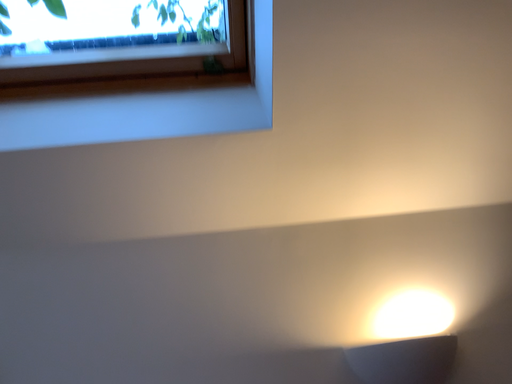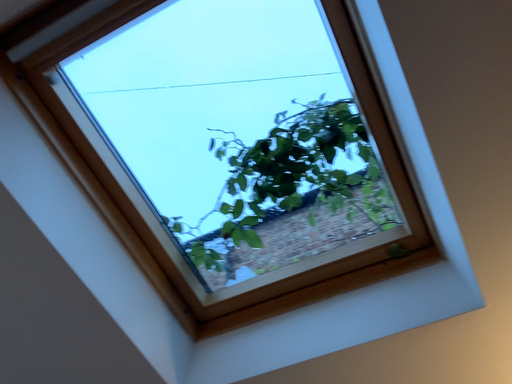
Question: Which way did the camera rotate in the video?

Choices:
 (A) rotated downward
 (B) rotated upward

Answer: (B)